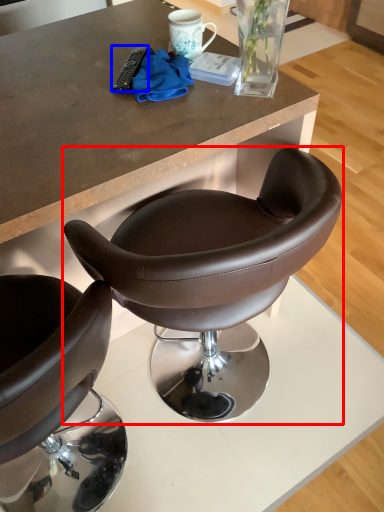
Question: Among these objects, which one is farthest to the camera, chair (highlighted by a red box) or remote control (highlighted by a blue box)?

Choices:
 (A) chair
 (B) remote control

Answer: (B)